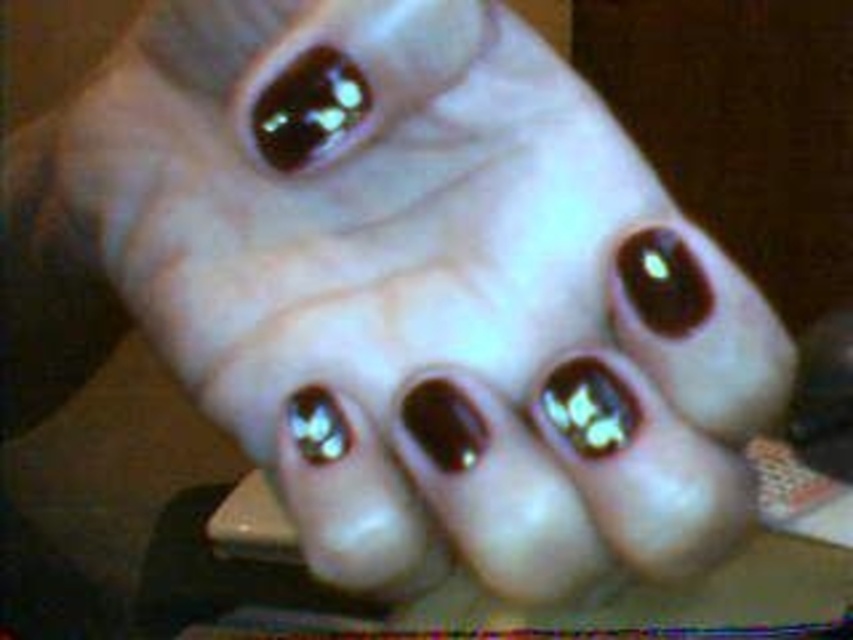
You are a nail technician assessing a client who has both shiny dark brown nail polish at upper center and shiny metallic nail polish at center on their nails. Which nail polish is positioned higher up on the nail?

The shiny dark brown nail polish at upper center is positioned higher up on the nail because it is located above the shiny metallic nail polish at center.

Based on the scene described, which nail polish is wider, the shiny dark brown nail polish at upper center or the shiny metallic nail polish at center?

The shiny dark brown nail polish at upper center might be wider than the shiny metallic nail polish at center according to the description.

You are a nail technician observing a client who has two nail polishes on their hand. You need to inform them about their placement. Which nail polish is on the left side between the shiny dark brown nail polish at upper center and the shiny metallic nail polish at center?

The shiny dark brown nail polish at upper center is positioned on the left side of the shiny metallic nail polish at center.